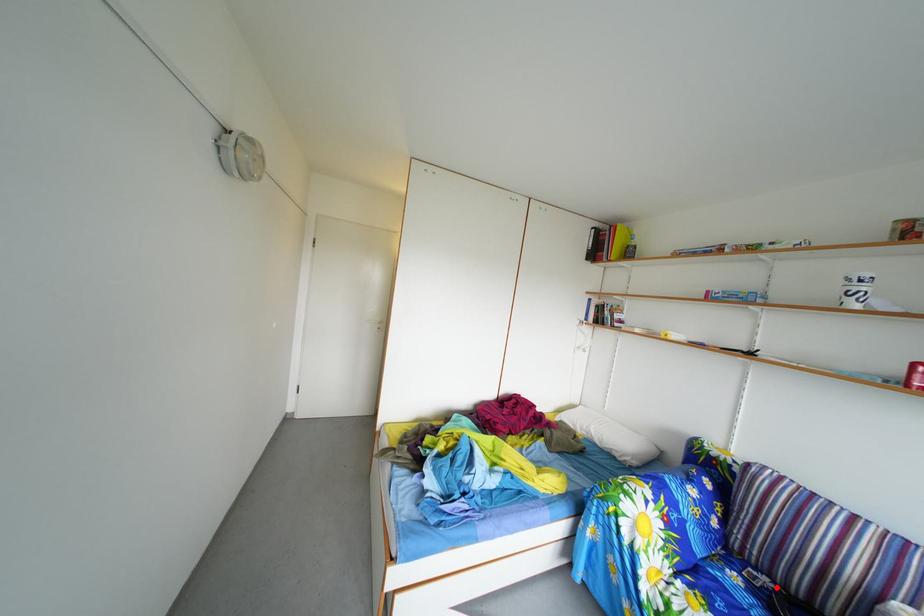
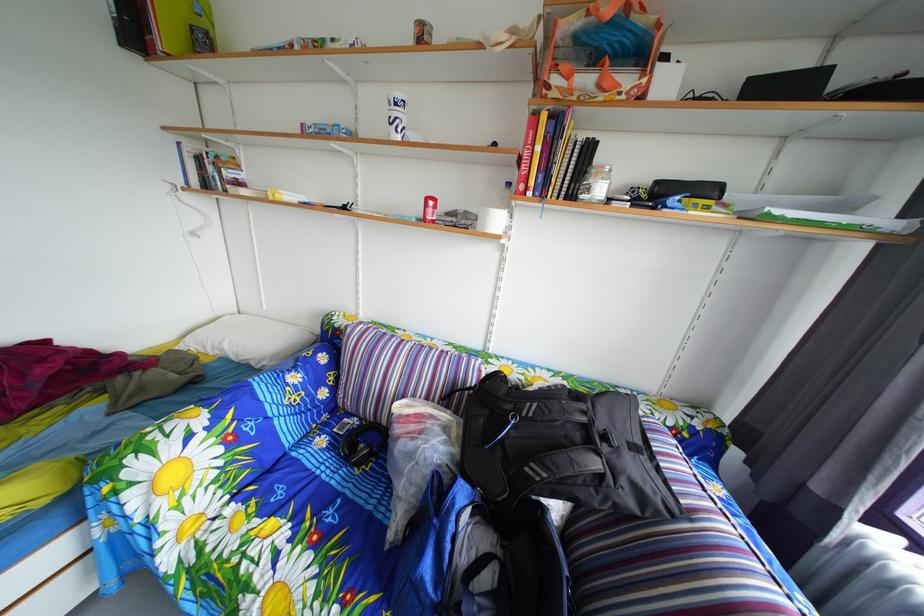
The point at the highlighted location is marked in the first image. Where is the corresponding point in the second image?

(367, 428)